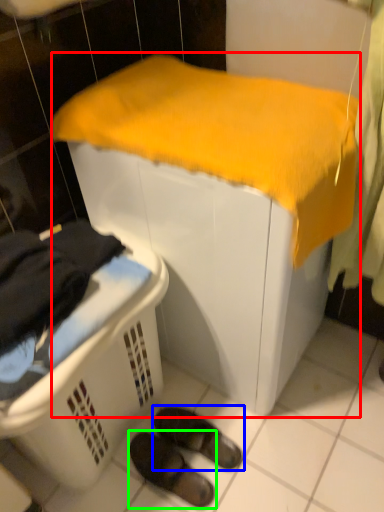
Question: Considering the real-world distances, which object is farthest from furniture (highlighted by a red box)? footwear (highlighted by a blue box) or footwear (highlighted by a green box)?

Choices:
 (A) footwear
 (B) footwear

Answer: (B)